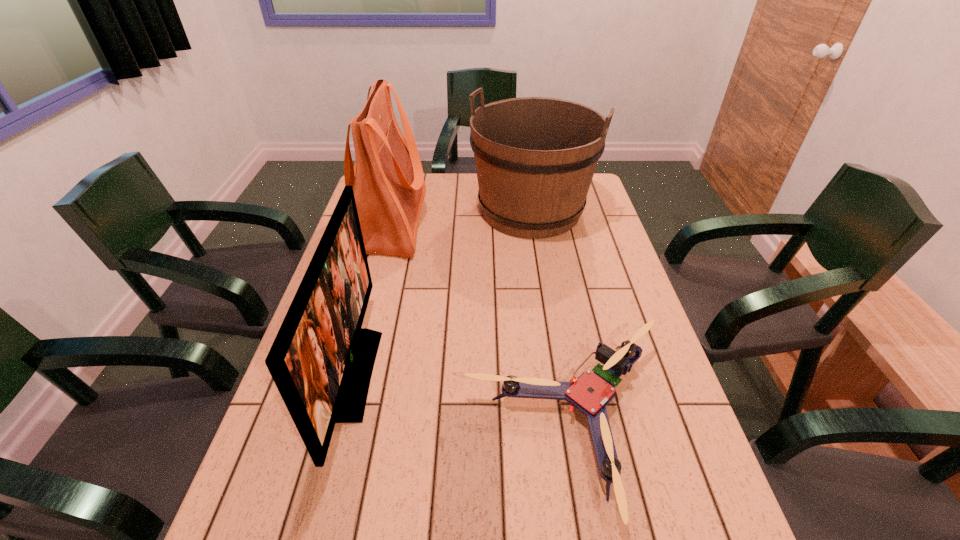
At what (x,y) coordinates should I click in order to perform the action: click on shopping bag. Please return your answer as a coordinate pair (x, y). The image size is (960, 540). Looking at the image, I should click on (387, 178).

In order to click on bucket in this screenshot , I will do `click(535, 157)`.

Where is `monitor`? The height and width of the screenshot is (540, 960). monitor is located at coordinates (321, 360).

Where is `vacant space located on the front pocket of the shopping bag`? vacant space located on the front pocket of the shopping bag is located at coordinates (509, 221).

This screenshot has width=960, height=540. Find the location of `free location located 0.150m on the left of the bucket`. free location located 0.150m on the left of the bucket is located at coordinates (429, 211).

Where is `vacant area located on the front-facing side of the monitor`? vacant area located on the front-facing side of the monitor is located at coordinates (494, 374).

I want to click on shopping bag located in the far edge section of the desktop, so click(387, 178).

Where is `bucket that is positioned at the far edge`? This screenshot has height=540, width=960. bucket that is positioned at the far edge is located at coordinates (535, 157).

Where is `shopping bag situated at the left edge`? This screenshot has height=540, width=960. shopping bag situated at the left edge is located at coordinates (387, 178).

Locate an element on the screen. This screenshot has width=960, height=540. monitor present at the left edge is located at coordinates (321, 360).